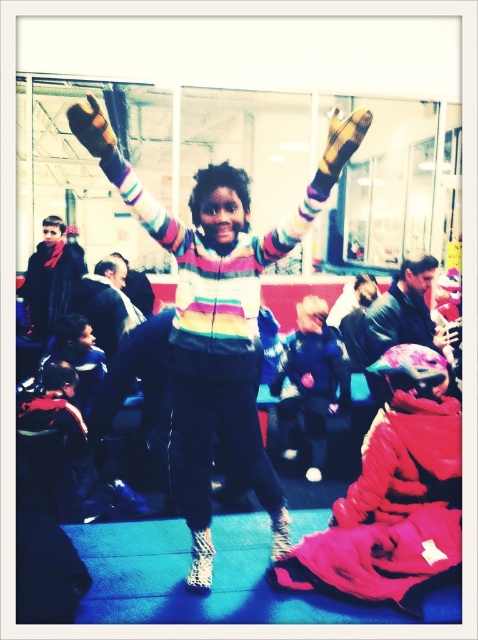
Looking at this image, who is positioned more to the left, striped sweater at center or shiny blue jacket at center?

striped sweater at center is more to the left.

The height and width of the screenshot is (640, 478). I want to click on striped sweater at center, so click(218, 314).

This screenshot has height=640, width=478. Find the location of `striped sweater at center`. striped sweater at center is located at coordinates (218, 314).